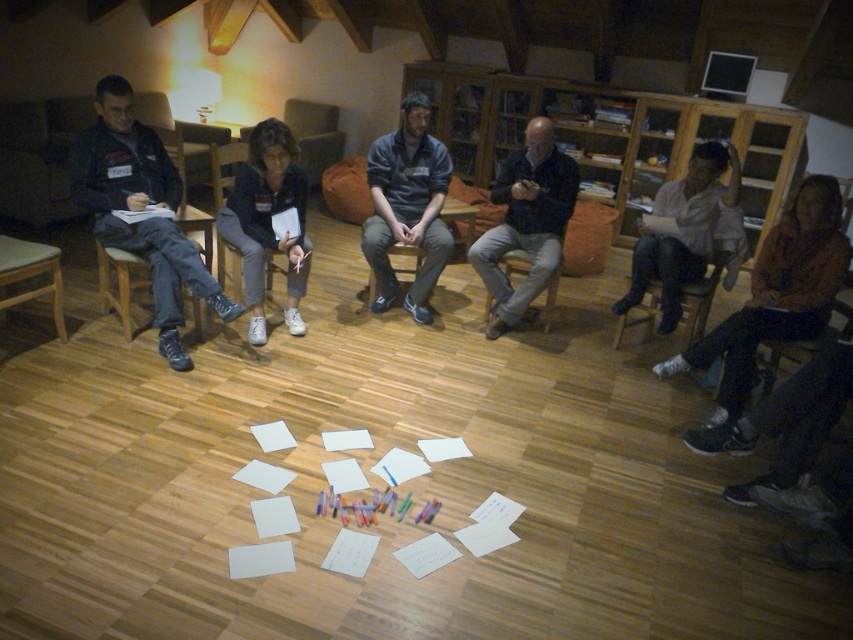
Question: Can you confirm if dark blue shirt at center is wider than wooden chair at left?

Choices:
 (A) no
 (B) yes

Answer: (A)

Question: Considering the real-world distances, which object is closest to the matte black jacket at left?

Choices:
 (A) dark blue sweater at center
 (B) brown leather jacket at lower right
 (C) wooden chair at left
 (D) matte black jacket at center

Answer: (C)

Question: Which object is farther from the camera taking this photo?

Choices:
 (A) matte black jacket at left
 (B) dark blue shirt at center
 (C) wooden chair at left
 (D) dark blue sweater at center

Answer: (B)

Question: Does dark blue shirt at center have a smaller size compared to white shirt at right?

Choices:
 (A) yes
 (B) no

Answer: (A)

Question: Can you confirm if dark blue sweater at center is positioned to the right of white shirt at right?

Choices:
 (A) no
 (B) yes

Answer: (A)

Question: Among these points, which one is farthest from the camera?

Choices:
 (A) (525, 218)
 (B) (107, 257)

Answer: (A)